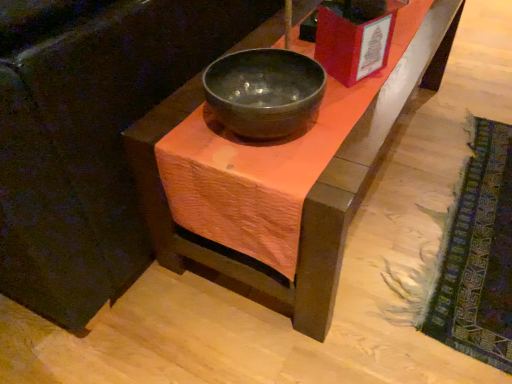
The width and height of the screenshot is (512, 384). Describe the element at coordinates (264, 92) in the screenshot. I see `matte black bowl at center` at that location.

What is the approximate width of matte black bowl at center?

matte black bowl at center is 9.84 inches wide.

Measure the distance between textured woolen mat at lower right and camera.

The distance of textured woolen mat at lower right from camera is 38.56 inches.

In order to click on matte black bowl at center in this screenshot , I will do `click(264, 92)`.

Consider the image. Is matte black bowl at center smaller than textured woolen mat at lower right?

No, matte black bowl at center is not smaller than textured woolen mat at lower right.

From the image's perspective, which is above, matte black bowl at center or textured woolen mat at lower right?

matte black bowl at center.

You are a GUI agent. You are given a task and a screenshot of the screen. Output one action in this format:
    pyautogui.click(x=<x>, y=<y>)
    Task: Click on the mat below the matte black bowl at center (from the image's perspective)
    The image size is (512, 384).
    Given the screenshot: What is the action you would take?
    pyautogui.click(x=478, y=254)

Locate an element on the screen. This screenshot has width=512, height=384. bowl that is above the matte black bowl at center (from a real-world perspective) is located at coordinates (264, 92).

Does matte black bowl at center have a larger size compared to matte black bowl at center?

Actually, matte black bowl at center might be smaller than matte black bowl at center.

Is matte black bowl at center turned away from matte black bowl at center?

No, matte black bowl at center is not facing away from matte black bowl at center.

From a real-world perspective, which is physically above, matte black bowl at center or matte black bowl at center?

In real-world perspective, matte black bowl at center is above.

Between textured woolen mat at lower right and matte black bowl at center, which one has more height?

matte black bowl at center.

From the image's perspective, is textured woolen mat at lower right above or below matte black bowl at center?

Clearly, from the image's perspective, textured woolen mat at lower right is below matte black bowl at center.

Consider the image. Is textured woolen mat at lower right with matte black bowl at center?

No.

How many degrees apart are the facing directions of textured woolen mat at lower right and matte black bowl at center?

The angle between the facing direction of textured woolen mat at lower right and the facing direction of matte black bowl at center is 180 degrees.

Considering the sizes of textured woolen mat at lower right and matte black bowl at center in the image, is textured woolen mat at lower right bigger or smaller than matte black bowl at center?

textured woolen mat at lower right is bigger than matte black bowl at center.

In the image, is textured woolen mat at lower right on the left side or the right side of matte black bowl at center?

In the image, textured woolen mat at lower right appears on the right side of matte black bowl at center.

Is textured woolen mat at lower right positioned far away from matte black bowl at center?

No, textured woolen mat at lower right is not far from matte black bowl at center.

At what (x,y) coordinates should I click in order to perform the action: click on table located above the matte black bowl at center (from the image's perspective). Please return your answer as a coordinate pair (x, y). The height and width of the screenshot is (384, 512). Looking at the image, I should click on (308, 194).

Between matte black bowl at center and matte black bowl at center, which one appears on the right side from the viewer's perspective?

Positioned to the right is matte black bowl at center.

Is point (249, 44) positioned behind point (254, 53)?

Yes, point (249, 44) is behind point (254, 53).

Can you confirm if matte black bowl at center is thinner than matte black bowl at center?

In fact, matte black bowl at center might be wider than matte black bowl at center.

Which is farther from the camera, (255,59) or (444,325)?

Positioned behind is point (444,325).

Is matte black bowl at center with textured woolen mat at lower right?

No, matte black bowl at center is not beside textured woolen mat at lower right.

The width and height of the screenshot is (512, 384). Identify the location of mat behind the matte black bowl at center. (478, 254).

Considering the positions of objects matte black bowl at center and textured woolen mat at lower right in the image provided, who is more to the right, matte black bowl at center or textured woolen mat at lower right?

Positioned to the right is textured woolen mat at lower right.

What are the coordinates of `table that is above the textured woolen mat at lower right (from a real-world perspective)` in the screenshot? It's located at (308, 194).

This screenshot has height=384, width=512. What are the coordinates of `table located above the matte black bowl at center (from the image's perspective)` in the screenshot? It's located at (308, 194).

Estimate the real-world distances between objects in this image. Which object is further from matte black bowl at center, matte black bowl at center or textured woolen mat at lower right?

Based on the image, textured woolen mat at lower right appears to be further to matte black bowl at center.

Which object lies nearer to the anchor point textured woolen mat at lower right, matte black bowl at center or matte black bowl at center?

matte black bowl at center.

Which object lies further to the anchor point matte black bowl at center, textured woolen mat at lower right or matte black bowl at center?

textured woolen mat at lower right is further to matte black bowl at center.

Which object lies further to the anchor point matte black bowl at center, textured woolen mat at lower right or matte black bowl at center?

textured woolen mat at lower right is positioned further to the anchor matte black bowl at center.

Based on their spatial positions, is matte black bowl at center or textured woolen mat at lower right further from matte black bowl at center?

textured woolen mat at lower right is positioned further to the anchor matte black bowl at center.

From the picture: Looking at the image, which one is located further to textured woolen mat at lower right, matte black bowl at center or matte black bowl at center?

Based on the image, matte black bowl at center appears to be further to textured woolen mat at lower right.

The image size is (512, 384). Identify the location of table between matte black bowl at center and textured woolen mat at lower right from left to right. (308, 194).